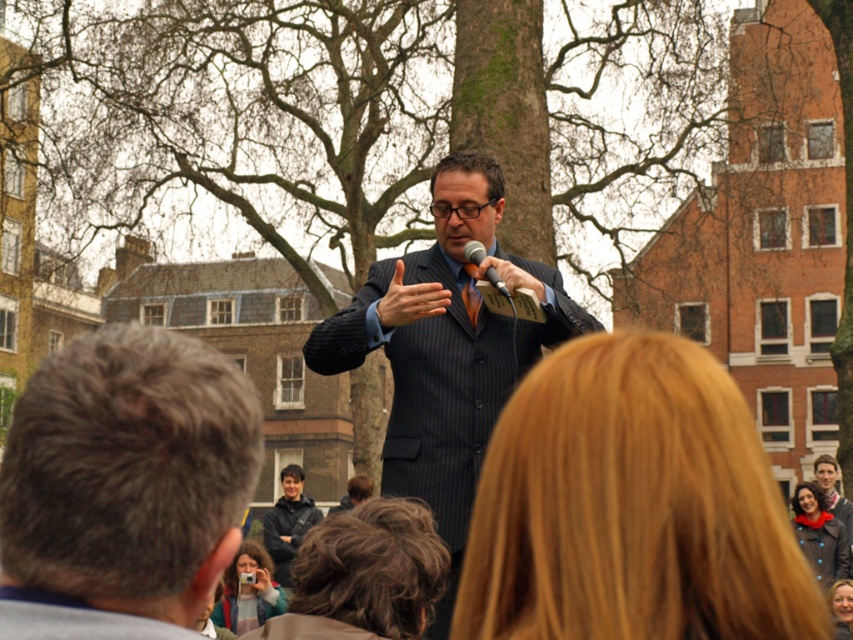
You are a photographer at the event and want to capture a photo of both the dark brown hair at center and the smooth brown hair at center. Which one will appear larger in the photo?

The dark brown hair at center will appear larger in the photo because it is closer to the viewer than the smooth brown hair at center.

You are a photographer at the event and want to frame both the gray hair at center and the smooth brown hair at center in your shot. Which hair has a wider width to ensure proper framing?

The gray hair at center has a wider width than the smooth brown hair at center, so you should frame the gray hair at center first to ensure proper framing.

You are standing in the crowd at this public speaking event. You notice two points marked in the scene. The first point is at coordinates point [416,586], and the second is at point [840,596]. Which point is closer to you?

Point [416,586] is closer to the viewer than point [840,596].